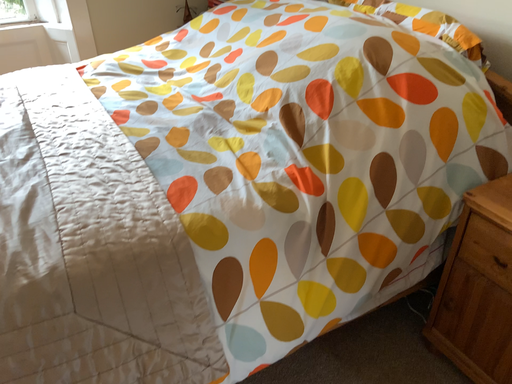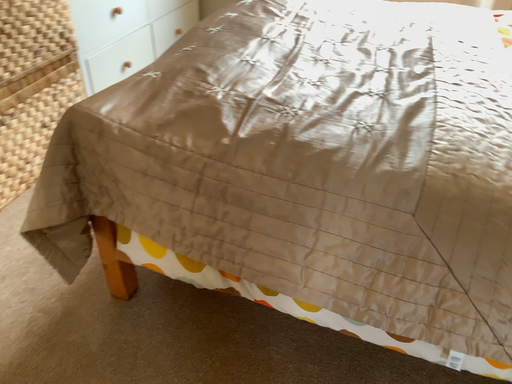
Question: How did the camera likely rotate when shooting the video?

Choices:
 (A) rotated right
 (B) rotated left

Answer: (B)